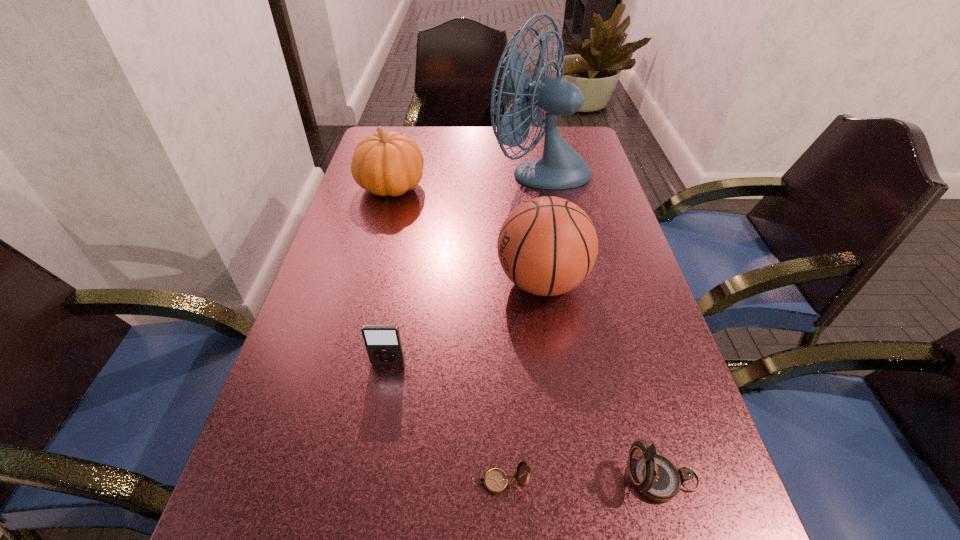
Find the location of `vacant space at the right edge of the desktop`. vacant space at the right edge of the desktop is located at coordinates (693, 410).

Locate an element on the screen. The image size is (960, 540). vacant space at the far right corner of the desktop is located at coordinates (594, 161).

You are a GUI agent. You are given a task and a screenshot of the screen. Output one action in this format:
    pyautogui.click(x=<x>, y=<y>)
    Task: Click on the free spot between the fourth nearest object and the taller compass
    This screenshot has width=960, height=540.
    Given the screenshot: What is the action you would take?
    pyautogui.click(x=603, y=381)

Locate an element on the screen. blank region between the iPod and the fan is located at coordinates (464, 267).

Where is `free space between the third nearest object and the fan`? Image resolution: width=960 pixels, height=540 pixels. free space between the third nearest object and the fan is located at coordinates (464, 267).

You are a GUI agent. You are given a task and a screenshot of the screen. Output one action in this format:
    pyautogui.click(x=<x>, y=<y>)
    Task: Click on the free space between the pumpkin and the third farthest object
    Image resolution: width=960 pixels, height=540 pixels.
    Given the screenshot: What is the action you would take?
    pyautogui.click(x=467, y=234)

You are a GUI agent. You are given a task and a screenshot of the screen. Output one action in this format:
    pyautogui.click(x=<x>, y=<y>)
    Task: Click on the vacant space that's between the right compass and the third nearest object
    The height and width of the screenshot is (540, 960).
    Given the screenshot: What is the action you would take?
    click(x=525, y=421)

Locate an element on the screen. free spot between the fan and the right compass is located at coordinates (601, 325).

Identify the location of unoccupied area between the tallest object and the iPod. (464, 267).

Locate an element on the screen. Image resolution: width=960 pixels, height=540 pixels. vacant space in between the taller compass and the tallest object is located at coordinates (601, 325).